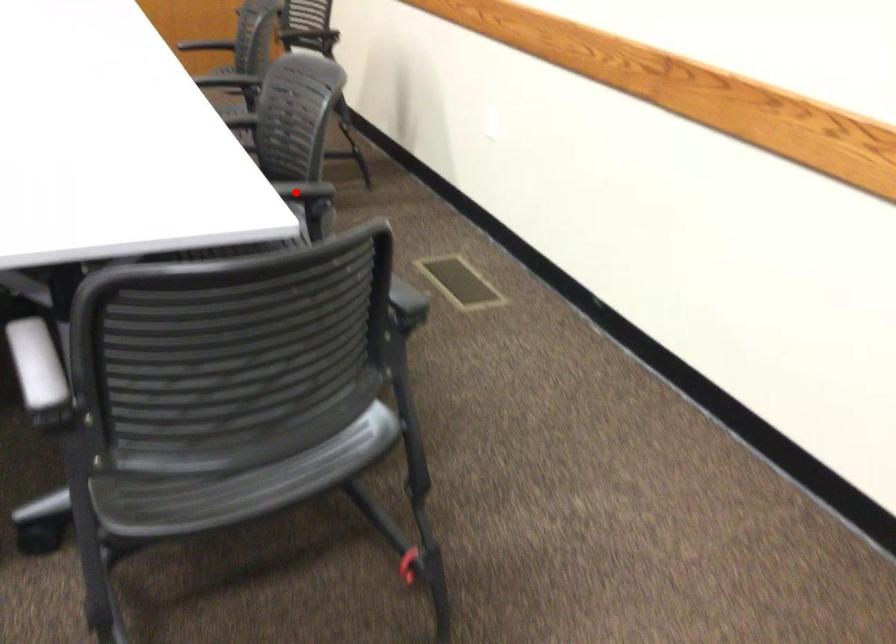
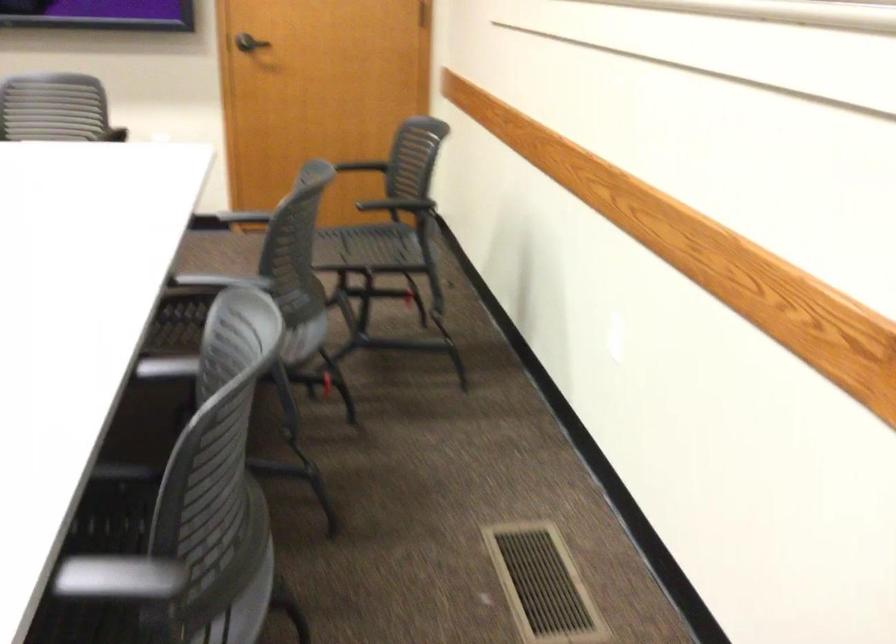
Where in the second image is the point corresponding to the highlighted location from the first image?

(118, 578)